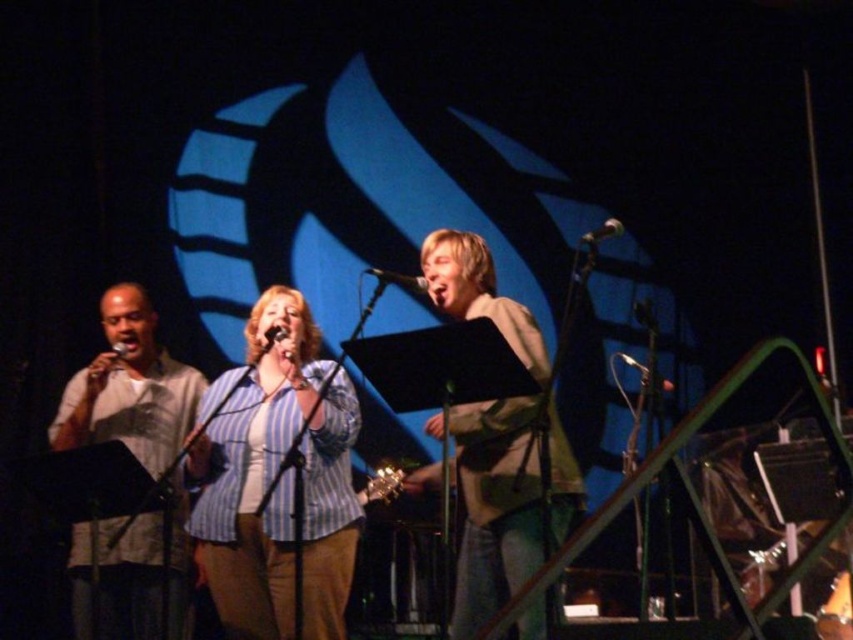
You are a photographer standing at the back of the stage. You want to take a photo of the blue striped shirt at center and the metallic silver microphone at upper center in the same frame. Given that your camera has a minimum focus distance of 1.5 meters, will you be able to capture both objects clearly without moving closer?

The blue striped shirt at center and the metallic silver microphone at upper center are 1.33 meters apart from each other. Since the distance between them is less than the camera minimum focus distance of 1.5 meters, the photographer can capture both objects clearly without moving closer.

You are a photographer in the audience. You want to capture a photo where the blue striped shirt at center is framed perfectly under the metallic silver microphone at upper center. Based on the scene description, can you confirm if this arrangement is possible?

Yes, the blue striped shirt at center is below the metallic silver microphone at upper center, so framing it under the microphone is possible.

You are a photographer standing at the camera position. You want to capture a closeup shot of the person on the left. The camera can focus on objects within 3 meters. Is the point at (404, 276) within the focus range?

The point at (404, 276) is 2.98 meters away from the camera, which is within the 3 meter focus range. Yes, the camera can focus on that point.